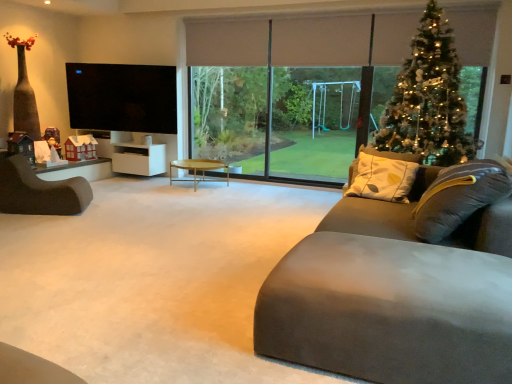
Question: Is iridescent metallic christmas tree at upper right closer to the viewer compared to wooden round coffee table at center?

Choices:
 (A) yes
 (B) no

Answer: (A)

Question: From the image's perspective, is iridescent metallic christmas tree at upper right under wooden round coffee table at center?

Choices:
 (A) no
 (B) yes

Answer: (A)

Question: Considering the relative sizes of iridescent metallic christmas tree at upper right and wooden round coffee table at center in the image provided, is iridescent metallic christmas tree at upper right taller than wooden round coffee table at center?

Choices:
 (A) no
 (B) yes

Answer: (B)

Question: Is iridescent metallic christmas tree at upper right thinner than wooden round coffee table at center?

Choices:
 (A) yes
 (B) no

Answer: (A)

Question: Does iridescent metallic christmas tree at upper right have a greater width compared to wooden round coffee table at center?

Choices:
 (A) no
 (B) yes

Answer: (A)

Question: Is iridescent metallic christmas tree at upper right aimed at wooden round coffee table at center?

Choices:
 (A) no
 (B) yes

Answer: (A)

Question: From the image's perspective, is transparent glass window at center located beneath white matte cabinet at left?

Choices:
 (A) yes
 (B) no

Answer: (B)

Question: Is transparent glass window at center outside of white matte cabinet at left?

Choices:
 (A) no
 (B) yes

Answer: (B)

Question: Considering the relative positions of transparent glass window at center and white matte cabinet at left in the image provided, is transparent glass window at center behind white matte cabinet at left?

Choices:
 (A) yes
 (B) no

Answer: (B)

Question: From the image's perspective, is transparent glass window at center over white matte cabinet at left?

Choices:
 (A) yes
 (B) no

Answer: (A)

Question: Is transparent glass window at center touching white matte cabinet at left?

Choices:
 (A) yes
 (B) no

Answer: (B)

Question: Considering the relative sizes of transparent glass window at center and white matte cabinet at left in the image provided, is transparent glass window at center thinner than white matte cabinet at left?

Choices:
 (A) no
 (B) yes

Answer: (B)

Question: From the image's perspective, does suede-like gray couch at lower right appear lower than white matte cabinet at left?

Choices:
 (A) no
 (B) yes

Answer: (B)